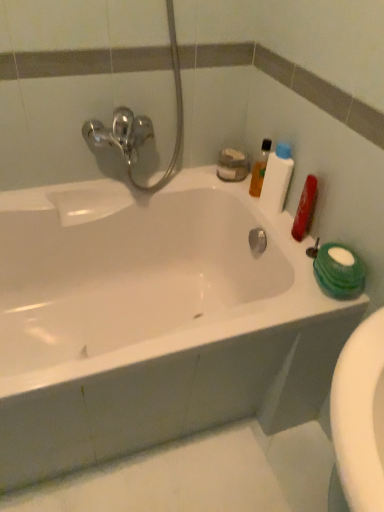
Question: Is white glossy bathtub at upper center oriented towards translucent plastic bottle at upper right?

Choices:
 (A) no
 (B) yes

Answer: (A)

Question: Considering the relative sizes of white glossy bathtub at upper center and translucent plastic bottle at upper right in the image provided, is white glossy bathtub at upper center bigger than translucent plastic bottle at upper right?

Choices:
 (A) no
 (B) yes

Answer: (B)

Question: Can you confirm if white glossy bathtub at upper center is taller than translucent plastic bottle at upper right?

Choices:
 (A) yes
 (B) no

Answer: (A)

Question: Is white glossy bathtub at upper center smaller than translucent plastic bottle at upper right?

Choices:
 (A) yes
 (B) no

Answer: (B)

Question: From a real-world perspective, is white glossy bathtub at upper center located higher than translucent plastic bottle at upper right?

Choices:
 (A) no
 (B) yes

Answer: (A)

Question: Is point (253, 193) positioned closer to the camera than point (74, 381)?

Choices:
 (A) closer
 (B) farther

Answer: (B)

Question: Is translucent plastic bottle at upper right in front of or behind white glossy bathtub at upper center in the image?

Choices:
 (A) behind
 (B) front

Answer: (A)

Question: Is translucent plastic bottle at upper right taller or shorter than white glossy bathtub at upper center?

Choices:
 (A) tall
 (B) short

Answer: (B)

Question: Based on their positions, is translucent plastic bottle at upper right located to the left or right of white glossy bathtub at upper center?

Choices:
 (A) left
 (B) right

Answer: (B)

Question: Considering the positions of translucent plastic bottle at upper right and white glossy bathtub at upper center in the image, is translucent plastic bottle at upper right bigger or smaller than white glossy bathtub at upper center?

Choices:
 (A) big
 (B) small

Answer: (B)

Question: Is translucent plastic bottle at upper right in front of or behind white glossy bathtub at upper center in the image?

Choices:
 (A) behind
 (B) front

Answer: (A)

Question: Is point (268, 163) closer or farther from the camera than point (130, 282)?

Choices:
 (A) farther
 (B) closer

Answer: (B)

Question: Looking at their shapes, would you say translucent plastic bottle at upper right is wider or thinner than white glossy bathtub at upper center?

Choices:
 (A) thin
 (B) wide

Answer: (A)

Question: Is white glossy bathtub at upper center to the left or to the right of translucent plastic bottle at upper right in the image?

Choices:
 (A) right
 (B) left

Answer: (B)

Question: Is white glossy bathtub at upper center situated inside translucent plastic bottle at upper right or outside?

Choices:
 (A) inside
 (B) outside

Answer: (B)